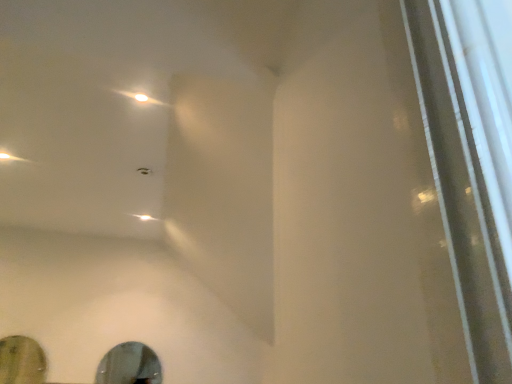
How much space does green matte mirror at lower left, arranged as the 1th mirror when viewed from the left, occupy horizontally?

green matte mirror at lower left, arranged as the 1th mirror when viewed from the left, is 1.10 inches wide.

At what (x,y) coordinates should I click in order to perform the action: click on green matte mirror at lower left, arranged as the 1th mirror when viewed from the left. Please return your answer as a coordinate pair (x, y). Looking at the image, I should click on (21, 361).

This screenshot has width=512, height=384. Describe the element at coordinates (21, 361) in the screenshot. I see `green matte mirror at lower left, arranged as the 1th mirror when viewed from the left` at that location.

What is the approximate height of green matte mirror at lower left, the second mirror from the right?

It is 19.13 inches.

In order to face green matte mirror at lower left, arranged as the 1th mirror when viewed from the left, should I rotate leftwards or rightwards?

Turn left by 29.718 degrees to look at green matte mirror at lower left, arranged as the 1th mirror when viewed from the left.

Where is `shiny silver mirror at lower center, which is counted as the 2th mirror, starting from the left`? shiny silver mirror at lower center, which is counted as the 2th mirror, starting from the left is located at coordinates pyautogui.click(x=129, y=365).

Based on the photo, what is the approximate width of shiny silver mirror at lower center, acting as the 1th mirror starting from the right?

It is 1.81 centimeters.

What do you see at coordinates (129, 365) in the screenshot?
I see `shiny silver mirror at lower center, acting as the 1th mirror starting from the right` at bounding box center [129, 365].

Locate an element on the screen. green matte mirror at lower left, arranged as the 1th mirror when viewed from the left is located at coordinates (21, 361).

Which is more to the left, shiny silver mirror at lower center, acting as the 1th mirror starting from the right, or green matte mirror at lower left, the second mirror from the right?

Positioned to the left is green matte mirror at lower left, the second mirror from the right.

In the scene shown: Is shiny silver mirror at lower center, acting as the 1th mirror starting from the right, in front of or behind green matte mirror at lower left, the second mirror from the right, in the image?

In the image, shiny silver mirror at lower center, acting as the 1th mirror starting from the right, appears behind green matte mirror at lower left, the second mirror from the right.

Which is in front, point (108, 379) or point (9, 373)?

The point (9, 373) is closer to the camera.

Based on the photo, from the image's perspective, which is above, shiny silver mirror at lower center, which is counted as the 2th mirror, starting from the left, or green matte mirror at lower left, the second mirror from the right?

From the image's view, green matte mirror at lower left, the second mirror from the right, is above.

From a real-world perspective, is shiny silver mirror at lower center, acting as the 1th mirror starting from the right, physically below green matte mirror at lower left, the second mirror from the right?

Yes, from a real-world perspective, shiny silver mirror at lower center, acting as the 1th mirror starting from the right, is beneath green matte mirror at lower left, the second mirror from the right.

Between shiny silver mirror at lower center, acting as the 1th mirror starting from the right, and green matte mirror at lower left, arranged as the 1th mirror when viewed from the left, which one has smaller width?

shiny silver mirror at lower center, acting as the 1th mirror starting from the right.

Between shiny silver mirror at lower center, which is counted as the 2th mirror, starting from the left, and green matte mirror at lower left, the second mirror from the right, which one has less height?

shiny silver mirror at lower center, which is counted as the 2th mirror, starting from the left, is shorter.

Looking at this image, can you confirm if shiny silver mirror at lower center, which is counted as the 2th mirror, starting from the left, is smaller than green matte mirror at lower left, arranged as the 1th mirror when viewed from the left?

Correct, shiny silver mirror at lower center, which is counted as the 2th mirror, starting from the left, occupies less space than green matte mirror at lower left, arranged as the 1th mirror when viewed from the left.

Is shiny silver mirror at lower center, acting as the 1th mirror starting from the right, positioned beyond the bounds of green matte mirror at lower left, the second mirror from the right?

Yes.

Is shiny silver mirror at lower center, which is counted as the 2th mirror, starting from the left, next to green matte mirror at lower left, the second mirror from the right, and touching it?

No, shiny silver mirror at lower center, which is counted as the 2th mirror, starting from the left, is not making contact with green matte mirror at lower left, the second mirror from the right.

Does shiny silver mirror at lower center, which is counted as the 2th mirror, starting from the left, turn towards green matte mirror at lower left, the second mirror from the right?

No, shiny silver mirror at lower center, which is counted as the 2th mirror, starting from the left, is not facing towards green matte mirror at lower left, the second mirror from the right.

Image resolution: width=512 pixels, height=384 pixels. Identify the location of mirror above the shiny silver mirror at lower center, acting as the 1th mirror starting from the right (from the image's perspective). (21, 361).

Consider the image. Between green matte mirror at lower left, arranged as the 1th mirror when viewed from the left, and shiny silver mirror at lower center, which is counted as the 2th mirror, starting from the left, which one appears on the left side from the viewer's perspective?

green matte mirror at lower left, arranged as the 1th mirror when viewed from the left.

In the scene shown: Relative to shiny silver mirror at lower center, acting as the 1th mirror starting from the right, is green matte mirror at lower left, arranged as the 1th mirror when viewed from the left, in front or behind?

Visually, green matte mirror at lower left, arranged as the 1th mirror when viewed from the left, is located in front of shiny silver mirror at lower center, acting as the 1th mirror starting from the right.

Is point (14, 362) positioned before point (110, 372)?

That is True.

From the image's perspective, between green matte mirror at lower left, arranged as the 1th mirror when viewed from the left, and shiny silver mirror at lower center, acting as the 1th mirror starting from the right, which one is located above?

green matte mirror at lower left, arranged as the 1th mirror when viewed from the left, from the image's perspective.

From a real-world perspective, is green matte mirror at lower left, the second mirror from the right, positioned above or below shiny silver mirror at lower center, acting as the 1th mirror starting from the right?

Clearly, from a real-world perspective, green matte mirror at lower left, the second mirror from the right, is above shiny silver mirror at lower center, acting as the 1th mirror starting from the right.

Considering the sizes of objects green matte mirror at lower left, the second mirror from the right, and shiny silver mirror at lower center, acting as the 1th mirror starting from the right, in the image provided, who is wider, green matte mirror at lower left, the second mirror from the right, or shiny silver mirror at lower center, acting as the 1th mirror starting from the right,?

green matte mirror at lower left, the second mirror from the right.

Can you confirm if green matte mirror at lower left, arranged as the 1th mirror when viewed from the left, is shorter than shiny silver mirror at lower center, which is counted as the 2th mirror, starting from the left?

Incorrect, the height of green matte mirror at lower left, arranged as the 1th mirror when viewed from the left, does not fall short of that of shiny silver mirror at lower center, which is counted as the 2th mirror, starting from the left.

Considering the sizes of objects green matte mirror at lower left, arranged as the 1th mirror when viewed from the left, and shiny silver mirror at lower center, acting as the 1th mirror starting from the right, in the image provided, who is smaller, green matte mirror at lower left, arranged as the 1th mirror when viewed from the left, or shiny silver mirror at lower center, acting as the 1th mirror starting from the right,?

shiny silver mirror at lower center, acting as the 1th mirror starting from the right.

Is shiny silver mirror at lower center, which is counted as the 2th mirror, starting from the left, surrounded by green matte mirror at lower left, arranged as the 1th mirror when viewed from the left?

That's incorrect, shiny silver mirror at lower center, which is counted as the 2th mirror, starting from the left, is not inside green matte mirror at lower left, arranged as the 1th mirror when viewed from the left.

Can you see green matte mirror at lower left, arranged as the 1th mirror when viewed from the left, touching shiny silver mirror at lower center, which is counted as the 2th mirror, starting from the left?

green matte mirror at lower left, arranged as the 1th mirror when viewed from the left, is not next to shiny silver mirror at lower center, which is counted as the 2th mirror, starting from the left, and they're not touching.

Does green matte mirror at lower left, the second mirror from the right, turn towards shiny silver mirror at lower center, acting as the 1th mirror starting from the right?

No, green matte mirror at lower left, the second mirror from the right, does not turn towards shiny silver mirror at lower center, acting as the 1th mirror starting from the right.

How many degrees apart are the facing directions of green matte mirror at lower left, arranged as the 1th mirror when viewed from the left, and shiny silver mirror at lower center, acting as the 1th mirror starting from the right?

The facing directions of green matte mirror at lower left, arranged as the 1th mirror when viewed from the left, and shiny silver mirror at lower center, acting as the 1th mirror starting from the right, are 0.0436 degrees apart.

The width and height of the screenshot is (512, 384). I want to click on mirror below the green matte mirror at lower left, the second mirror from the right (from a real-world perspective), so click(x=129, y=365).

Locate an element on the screen. mirror that is in front of the shiny silver mirror at lower center, which is counted as the 2th mirror, starting from the left is located at coordinates (21, 361).

Locate an element on the screen. The height and width of the screenshot is (384, 512). mirror below the green matte mirror at lower left, arranged as the 1th mirror when viewed from the left (from a real-world perspective) is located at coordinates (129, 365).